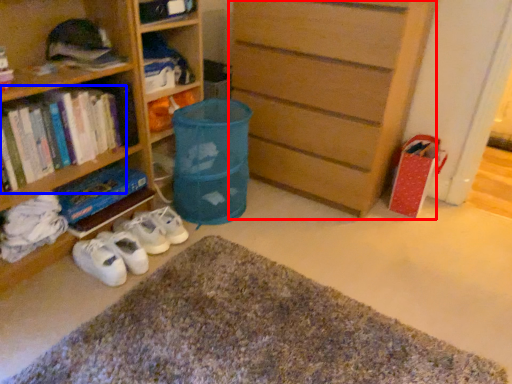
Question: Which object appears farthest to the camera in this image, chest of drawers (highlighted by a red box) or book (highlighted by a blue box)?

Choices:
 (A) chest of drawers
 (B) book

Answer: (A)